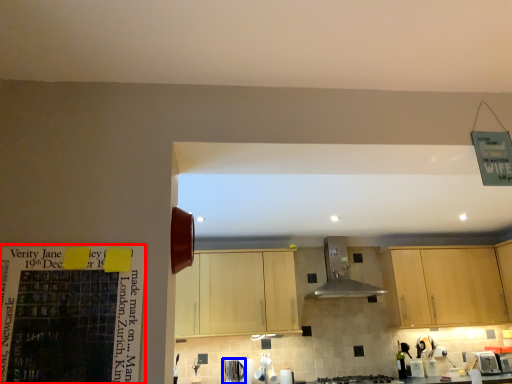
Question: Among these objects, which one is nearest to the camera, bulletin board (highlighted by a red box) or appliance (highlighted by a blue box)?

Choices:
 (A) bulletin board
 (B) appliance

Answer: (A)